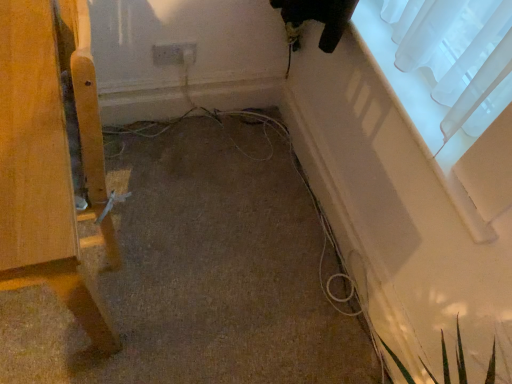
Question: From the image's perspective, would you say white plastic electric outlet at center is shown under transparent fabric at upper right?

Choices:
 (A) yes
 (B) no

Answer: (B)

Question: Considering the relative sizes of white plastic electric outlet at center and transparent fabric at upper right in the image provided, is white plastic electric outlet at center wider than transparent fabric at upper right?

Choices:
 (A) no
 (B) yes

Answer: (A)

Question: Is transparent fabric at upper right surrounded by white plastic electric outlet at center?

Choices:
 (A) yes
 (B) no

Answer: (B)

Question: From a real-world perspective, is white plastic electric outlet at center under transparent fabric at upper right?

Choices:
 (A) yes
 (B) no

Answer: (A)

Question: Is white plastic electric outlet at center facing away from transparent fabric at upper right?

Choices:
 (A) no
 (B) yes

Answer: (A)

Question: From the image's perspective, is white plastic electric outlet at center located above or below transparent fabric at upper right?

Choices:
 (A) below
 (B) above

Answer: (B)

Question: Is white plastic electric outlet at center in front of or behind transparent fabric at upper right in the image?

Choices:
 (A) front
 (B) behind

Answer: (B)

Question: Do you think white plastic electric outlet at center is within transparent fabric at upper right, or outside of it?

Choices:
 (A) outside
 (B) inside

Answer: (A)

Question: Is white plastic electric outlet at center taller or shorter than transparent fabric at upper right?

Choices:
 (A) short
 (B) tall

Answer: (B)

Question: Looking at the image, does wooden chair leg at left seem bigger or smaller compared to transparent fabric at upper right?

Choices:
 (A) small
 (B) big

Answer: (B)

Question: From a real-world perspective, relative to transparent fabric at upper right, is wooden chair leg at left vertically above or below?

Choices:
 (A) below
 (B) above

Answer: (A)

Question: From the image's perspective, is wooden chair leg at left positioned above or below transparent fabric at upper right?

Choices:
 (A) below
 (B) above

Answer: (A)

Question: Which is correct: wooden chair leg at left is inside transparent fabric at upper right, or outside of it?

Choices:
 (A) outside
 (B) inside

Answer: (A)

Question: Is transparent fabric at upper right spatially inside white plastic electric outlet at center, or outside of it?

Choices:
 (A) inside
 (B) outside

Answer: (B)

Question: Looking at the image, does transparent fabric at upper right seem bigger or smaller compared to white plastic electric outlet at center?

Choices:
 (A) big
 (B) small

Answer: (A)